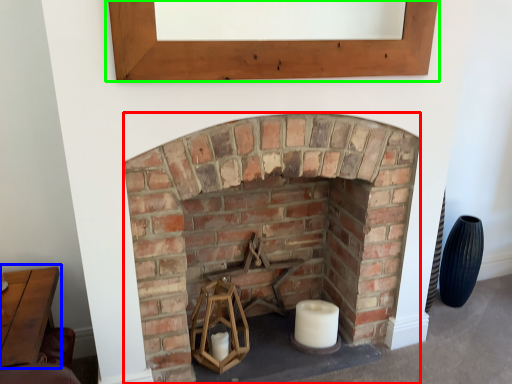
Question: Which object is the closest to the fireplace (highlighted by a red box)? Choose among these: table (highlighted by a blue box) or window frame (highlighted by a green box).

Choices:
 (A) table
 (B) window frame

Answer: (B)